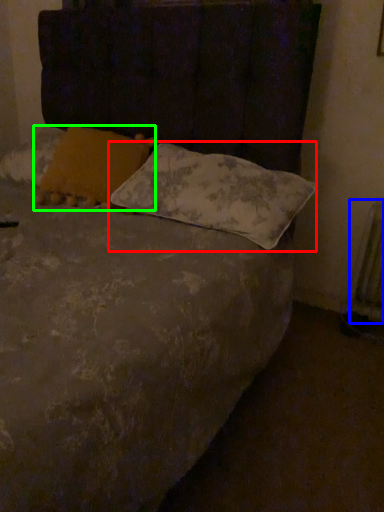
Question: Which object is the closest to the pillow (highlighted by a red box)? Choose among these: radiator (highlighted by a blue box) or pillow (highlighted by a green box).

Choices:
 (A) radiator
 (B) pillow

Answer: (B)